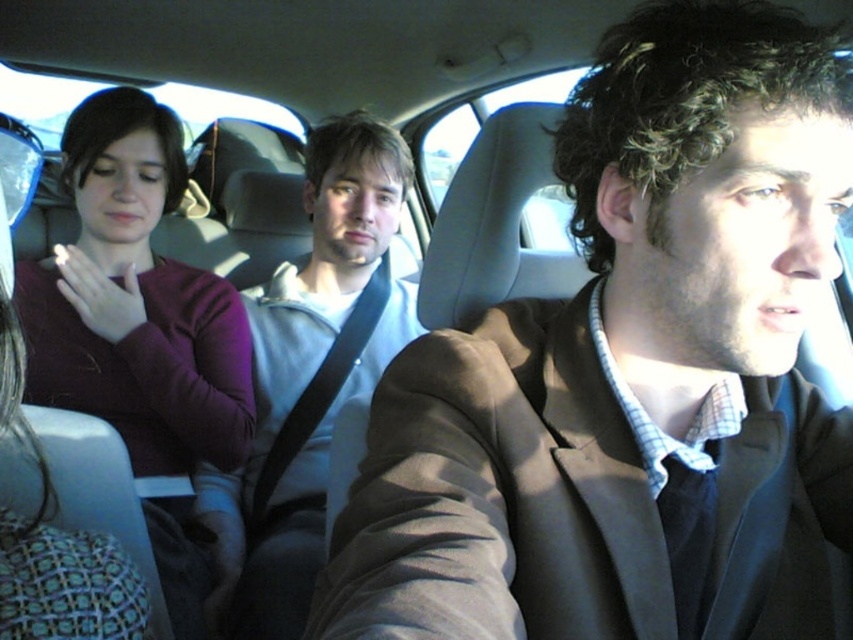
Question: Which is nearer to the light gray hoodie at center?

Choices:
 (A) brown fabric jacket at center
 (B) purple sweater at left

Answer: (B)

Question: Is purple sweater at left further to the viewer compared to light gray hoodie at center?

Choices:
 (A) yes
 (B) no

Answer: (B)

Question: Is purple sweater at left smaller than light gray hoodie at center?

Choices:
 (A) no
 (B) yes

Answer: (B)

Question: Which point is closer to the camera?

Choices:
 (A) purple sweater at left
 (B) light gray hoodie at center

Answer: (A)

Question: Which object is positioned farthest from the light gray hoodie at center?

Choices:
 (A) brown fabric jacket at center
 (B) purple sweater at left

Answer: (A)

Question: Does purple sweater at left appear on the left side of light gray hoodie at center?

Choices:
 (A) yes
 (B) no

Answer: (A)